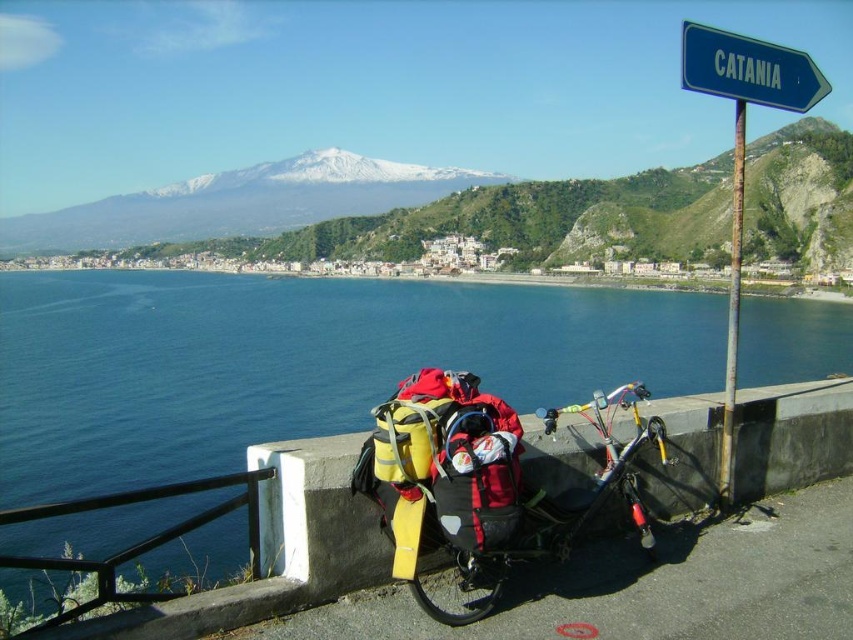
Who is more forward, (93, 561) or (698, 84)?

Point (698, 84) is in front.

Does black metal/rail at lower left have a greater width compared to blue plastic signpost at upper right?

Indeed, black metal/rail at lower left has a greater width compared to blue plastic signpost at upper right.

Is point (96, 604) more distant than point (709, 36)?

No, it is not.

Find the location of a particular element. The image size is (853, 640). black metal/rail at lower left is located at coordinates (137, 541).

Does blue metal signpost at upper right appear on the right side of rusty metal pole at right?

Indeed, blue metal signpost at upper right is positioned on the right side of rusty metal pole at right.

Is blue metal signpost at upper right above rusty metal pole at right?

Yes, blue metal signpost at upper right is above rusty metal pole at right.

Does point (729, 68) come farther from viewer compared to point (740, 132)?

No, it is in front of (740, 132).

You are a GUI agent. You are given a task and a screenshot of the screen. Output one action in this format:
    pyautogui.click(x=<x>, y=<y>)
    Task: Click on the blue metal signpost at upper right
    Image resolution: width=853 pixels, height=640 pixels.
    Given the screenshot: What is the action you would take?
    pyautogui.click(x=743, y=148)

Can you confirm if blue plastic signpost at upper right is positioned to the right of rusty metal pole at right?

No, blue plastic signpost at upper right is not to the right of rusty metal pole at right.

Consider the image. Does blue plastic signpost at upper right have a larger size compared to rusty metal pole at right?

Incorrect, blue plastic signpost at upper right is not larger than rusty metal pole at right.

Is point (741, 65) closer to viewer compared to point (734, 340)?

Yes, point (741, 65) is closer to viewer.

You are a GUI agent. You are given a task and a screenshot of the screen. Output one action in this format:
    pyautogui.click(x=<x>, y=<y>)
    Task: Click on the blue plastic signpost at upper right
    
    Given the screenshot: What is the action you would take?
    pyautogui.click(x=747, y=68)